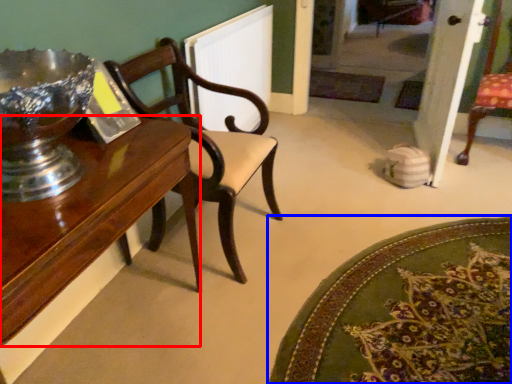
Question: Which object is further to the camera taking this photo, table (highlighted by a red box) or mat (highlighted by a blue box)?

Choices:
 (A) table
 (B) mat

Answer: (B)